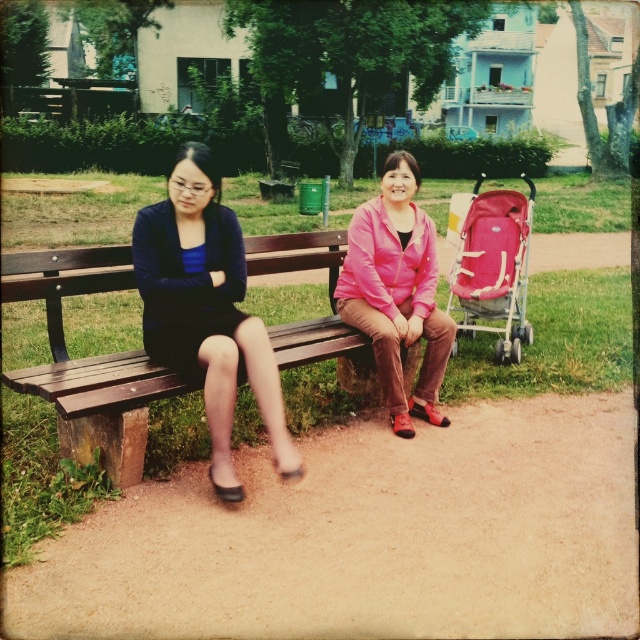
Is wooden bench at center below matte black dress at left?

Yes.

Which is behind, point (129, 449) or point (269, 440)?

Point (269, 440)

At what (x,y) coordinates should I click in order to perform the action: click on wooden bench at center. Please return your answer as a coordinate pair (x, y). The height and width of the screenshot is (640, 640). Looking at the image, I should click on (88, 362).

Can you confirm if matte black dress at left is positioned above pink matte jacket at center?

Actually, matte black dress at left is below pink matte jacket at center.

Between point (157, 218) and point (364, 326), which one is positioned behind?

The point (364, 326) is behind.

At what (x,y) coordinates should I click in order to perform the action: click on matte black dress at left. Please return your answer as a coordinate pair (x, y). The image size is (640, 640). Looking at the image, I should click on (205, 308).

Who is more forward, [26,384] or [381,236]?

Point [26,384] is more forward.

Is wooden bench at center thinner than pink matte jacket at center?

No.

Image resolution: width=640 pixels, height=640 pixels. Find the location of `wooden bench at center`. wooden bench at center is located at coordinates (88, 362).